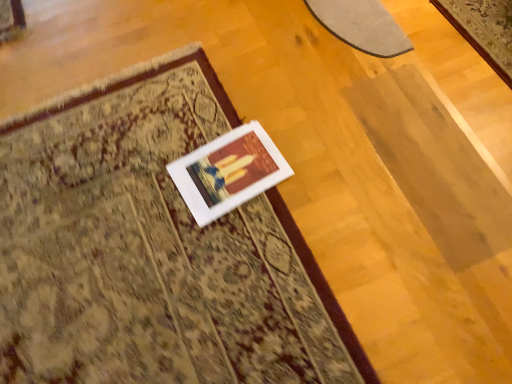
Where is `free spot below beige carpet at center, positioned as the first mat in front-to-back order (from a real-world perspective)`? This screenshot has width=512, height=384. free spot below beige carpet at center, positioned as the first mat in front-to-back order (from a real-world perspective) is located at coordinates (141, 232).